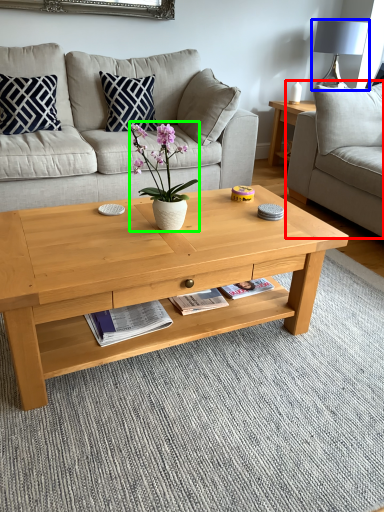
Question: Which object is positioned closest to studio couch (highlighted by a red box)? Select from lamp (highlighted by a blue box) and houseplant (highlighted by a green box).

Choices:
 (A) lamp
 (B) houseplant

Answer: (A)